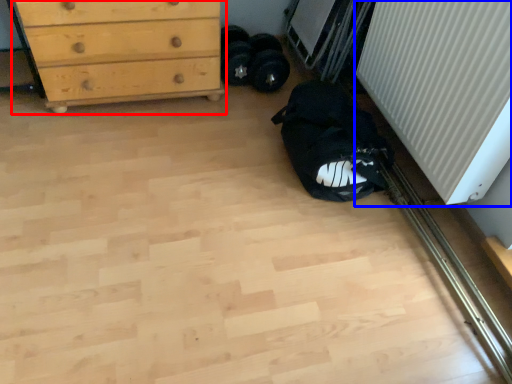
Question: Among these objects, which one is nearest to the camera, chest of drawers (highlighted by a red box) or radiator (highlighted by a blue box)?

Choices:
 (A) chest of drawers
 (B) radiator

Answer: (B)